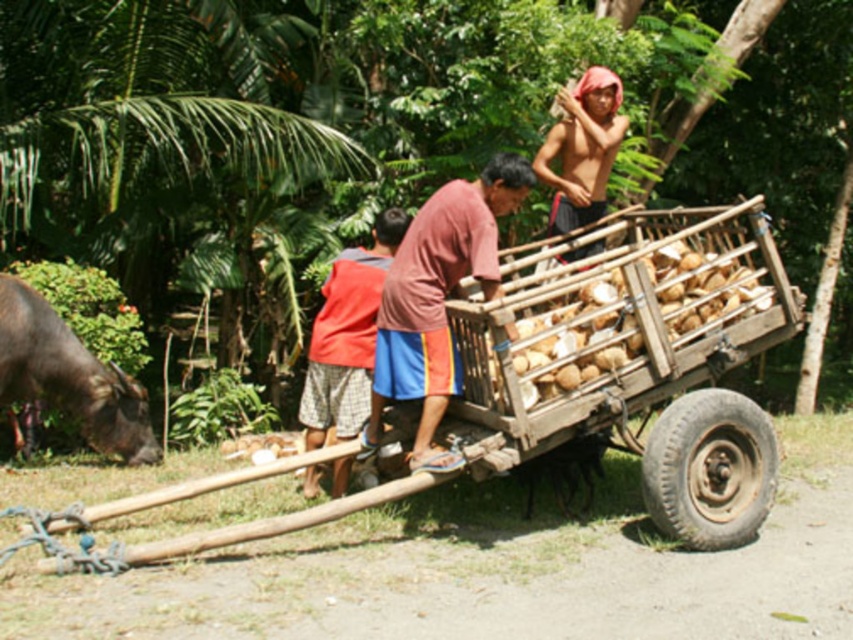
In the rural scene, where exactly is the wooden cart at center located in terms of coordinates?

The wooden cart at center is located at coordinates point (x=637, y=362).

Consider the image. You are a farmer in this rural area and need to determine which object is bigger between the wooden cart at center and the shiny red cloth at upper right. Can you identify the larger one?

The wooden cart at center has a larger size compared to the shiny red cloth at upper right, so the wooden cart at center is bigger.